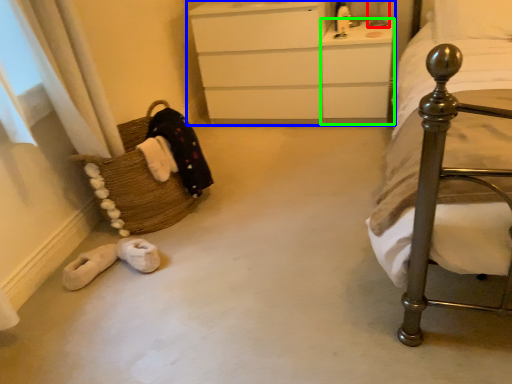
Question: Estimate the real-world distances between objects in this image. Which object is farther from table lamp (highlighted by a red box), chest of drawers (highlighted by a blue box) or vanity (highlighted by a green box)?

Choices:
 (A) chest of drawers
 (B) vanity

Answer: (A)